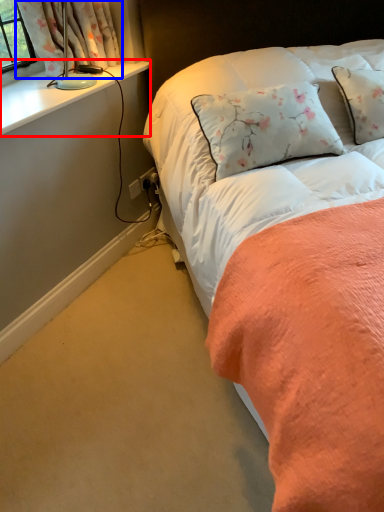
Question: Which of the following is the closest to the observer, window sill (highlighted by a red box) or curtain (highlighted by a blue box)?

Choices:
 (A) window sill
 (B) curtain

Answer: (A)